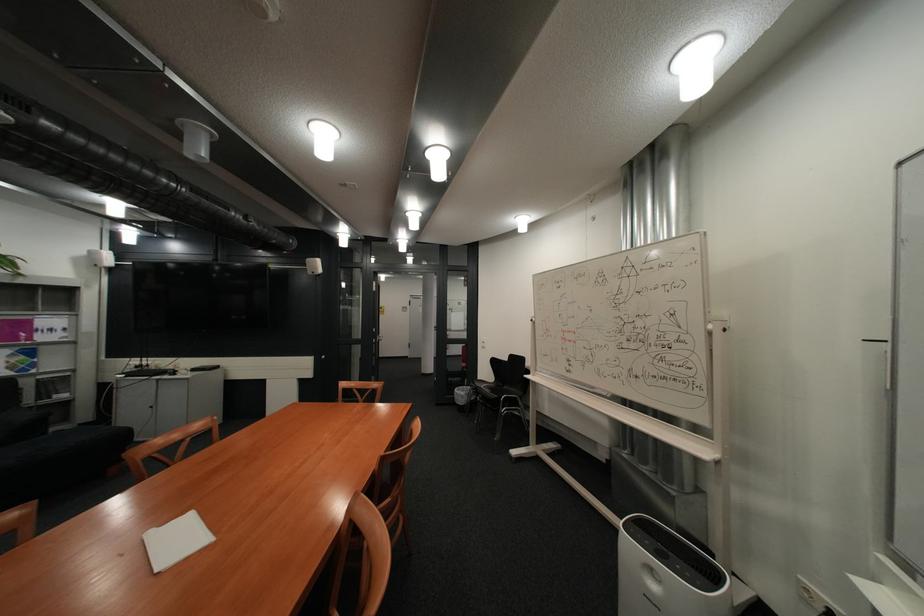
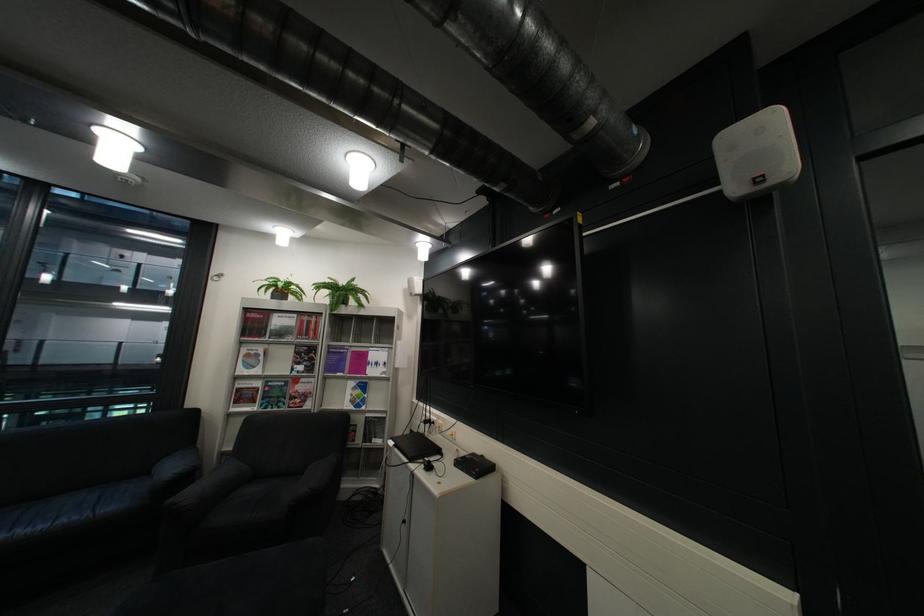
Locate, in the second image, the point that corresponds to (78,395) in the first image.

(393, 442)